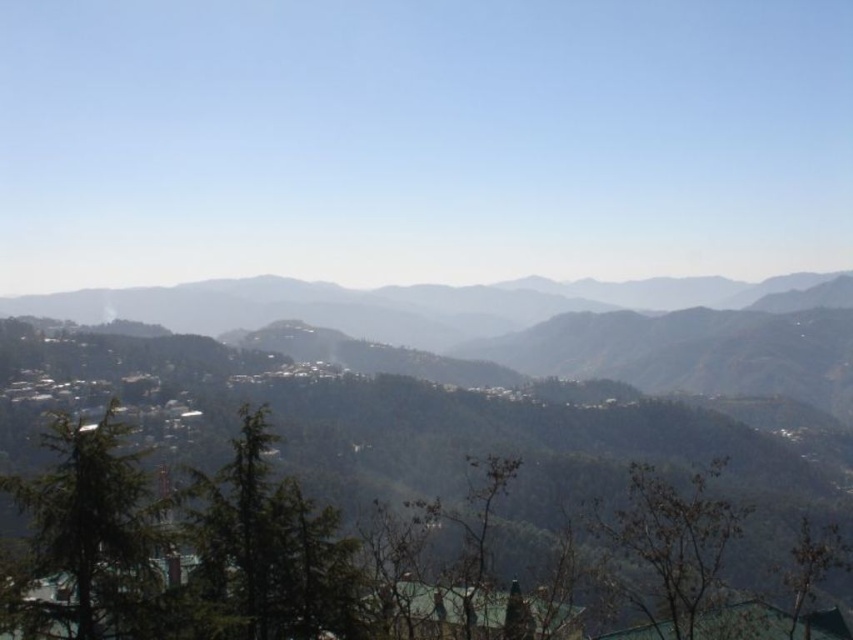
Is the position of green matte tree at left more distant than that of green leafy tree at lower right?

No, green matte tree at left is in front of green leafy tree at lower right.

Is green matte tree at left wider than green leafy tree at lower right?

No.

Measure the distance between green matte tree at left and camera.

green matte tree at left and camera are 79.71 feet apart.

You are a GUI agent. You are given a task and a screenshot of the screen. Output one action in this format:
    pyautogui.click(x=<x>, y=<y>)
    Task: Click on the green matte tree at left
    
    Given the screenshot: What is the action you would take?
    pyautogui.click(x=88, y=524)

Is green textured hillside at center wider than brown textured tree at lower right?

Yes, green textured hillside at center is wider than brown textured tree at lower right.

You are a GUI agent. You are given a task and a screenshot of the screen. Output one action in this format:
    pyautogui.click(x=<x>, y=<y>)
    Task: Click on the green textured hillside at center
    Image resolution: width=853 pixels, height=640 pixels.
    Given the screenshot: What is the action you would take?
    pyautogui.click(x=488, y=387)

At what (x,y) coordinates should I click in order to perform the action: click on green textured hillside at center. Please return your answer as a coordinate pair (x, y). This screenshot has width=853, height=640. Looking at the image, I should click on (488, 387).

Does green textured hillside at center lie behind green matte tree at center?

Answer: Yes, green textured hillside at center is further from the viewer.

Does green textured hillside at center have a smaller size compared to green matte tree at center?

No, green textured hillside at center is not smaller than green matte tree at center.

Is point (223, 349) farther from camera compared to point (222, 477)?

That is True.

Find the location of a particular element. The width and height of the screenshot is (853, 640). green textured hillside at center is located at coordinates (488, 387).